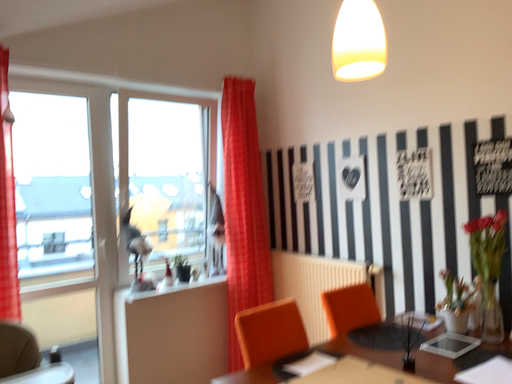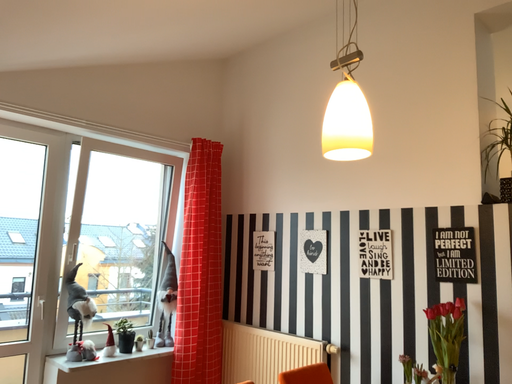
Question: How did the camera likely rotate when shooting the video?

Choices:
 (A) rotated right
 (B) rotated left

Answer: (A)